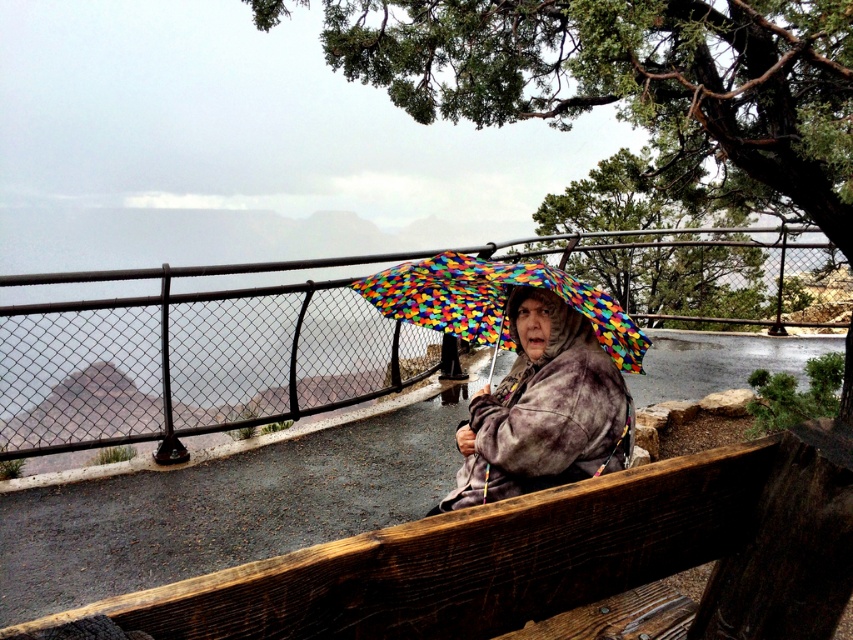
Is green textured tree at upper center below rainbow-patterned umbrella at center?

Actually, green textured tree at upper center is above rainbow-patterned umbrella at center.

Is green textured tree at upper center to the left of rainbow-patterned umbrella at center from the viewer's perspective?

No, green textured tree at upper center is not to the left of rainbow-patterned umbrella at center.

Is point (569, 68) closer to camera compared to point (550, 380)?

No, (569, 68) is behind (550, 380).

Where is `green textured tree at upper center`? This screenshot has height=640, width=853. green textured tree at upper center is located at coordinates (636, 83).

Who is shorter, metallic chain-link fence at center or rainbow-patterned umbrella at center?

With less height is rainbow-patterned umbrella at center.

Between metallic chain-link fence at center and rainbow-patterned umbrella at center, which one appears on the right side from the viewer's perspective?

Positioned to the right is metallic chain-link fence at center.

Where is `metallic chain-link fence at center`? This screenshot has height=640, width=853. metallic chain-link fence at center is located at coordinates (352, 332).

This screenshot has width=853, height=640. In order to click on metallic chain-link fence at center in this screenshot , I will do `click(352, 332)`.

Does metallic chain-link fence at center have a greater height compared to multicolored fabric umbrella at center?

Yes, metallic chain-link fence at center is taller than multicolored fabric umbrella at center.

Is point (167, 284) farther from viewer compared to point (618, 308)?

Yes, it is behind point (618, 308).

Does point (1, 371) come farther from viewer compared to point (445, 321)?

Yes, point (1, 371) is farther from viewer.

Find the location of a particular element. metallic chain-link fence at center is located at coordinates (352, 332).